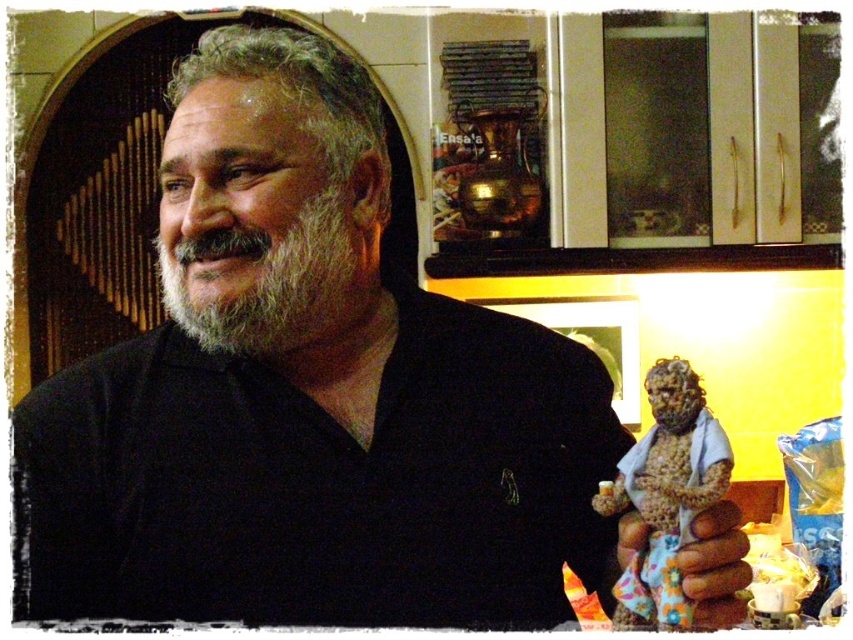
What are the coordinates of `graywoollybeard at left` in the screenshot? It's located at (270, 280).

Does graywoollybeard at left have a greater height compared to textured brown figurine at right?

No, graywoollybeard at left is not taller than textured brown figurine at right.

Identify the location of graywoollybeard at left. coord(270,280).

Does textured brown figurine at right appear on the right side of brown textured hand at lower right?

No, textured brown figurine at right is not to the right of brown textured hand at lower right.

Measure the distance between textured brown figurine at right and camera.

textured brown figurine at right and camera are 22.98 inches apart.

I want to click on textured brown figurine at right, so click(x=666, y=492).

Is graywoollybeard at left taller than brown textured hand at lower right?

Yes.

You are a GUI agent. You are given a task and a screenshot of the screen. Output one action in this format:
    pyautogui.click(x=<x>, y=<y>)
    Task: Click on the graywoollybeard at left
    Image resolution: width=853 pixels, height=640 pixels.
    Given the screenshot: What is the action you would take?
    pyautogui.click(x=270, y=280)

Does point (254, 332) lie in front of point (695, 579)?

That is False.

Where is `graywoollybeard at left`? Image resolution: width=853 pixels, height=640 pixels. graywoollybeard at left is located at coordinates (270, 280).